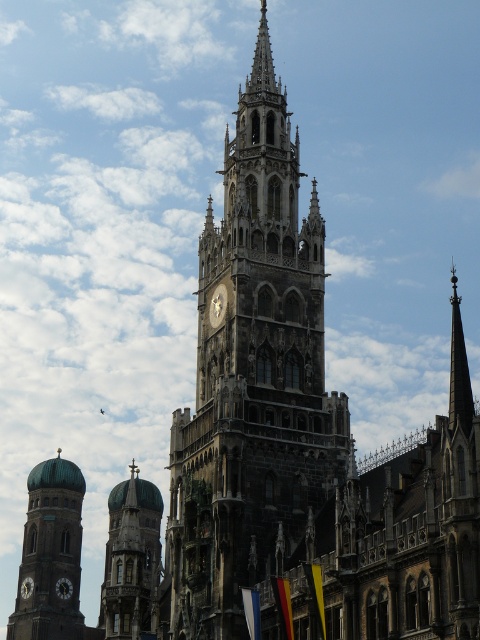
Between gold metallic clock at center and matte black clock at lower left, which one has less height?

Standing shorter between the two is matte black clock at lower left.

Which is behind, point (222, 291) or point (67, 593)?

Positioned behind is point (67, 593).

Find the location of `gold metallic clock at center`. gold metallic clock at center is located at coordinates (217, 305).

Can you confirm if shiny silver spire at upper right is shorter than gold metallic clock at center?

Incorrect, shiny silver spire at upper right's height does not fall short of gold metallic clock at center's.

Between shiny silver spire at upper right and gold metallic clock at center, which one is positioned lower?

shiny silver spire at upper right

Find the location of a particular element. The height and width of the screenshot is (640, 480). shiny silver spire at upper right is located at coordinates (458, 369).

This screenshot has width=480, height=640. Find the location of `shiny silver spire at upper right`. shiny silver spire at upper right is located at coordinates (458, 369).

Does green copper dome at left appear under green glazed dome at center?

No, green copper dome at left is not below green glazed dome at center.

Is point (60, 474) behind point (146, 488)?

Yes.

Is point (62, 536) closer to camera compared to point (136, 476)?

No, (62, 536) is further to viewer.

Find the location of `green copper dome at left`. green copper dome at left is located at coordinates (50, 554).